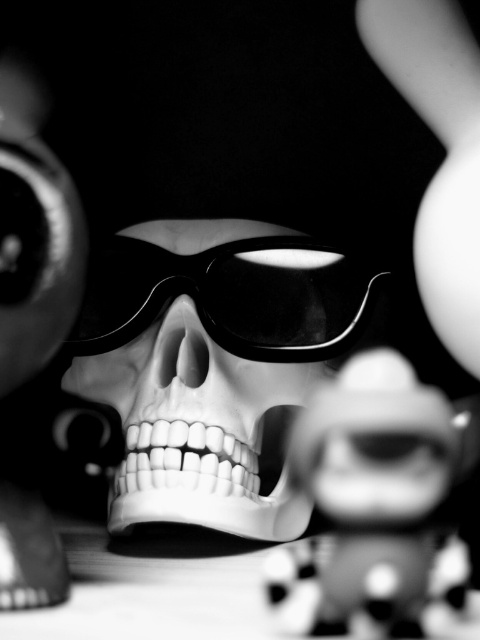
In the scene shown: You are an observer looking at the image. There are two points marked in the scene. The first point is at coordinates point (310, 582) and the second is at point (134, 296). Which point is closer to you?

Point (310, 582) is in front of point (134, 296), so it is closer to you.

You are an artist trying to paint this scene. You need to know which object should be painted larger to maintain the correct proportions. Which one should you make bigger between the polka dot fabric skull at center and the black glossy goggles at center?

The polka dot fabric skull at center is bigger than the black glossy goggles at center, so you should paint the polka dot fabric skull at center larger to maintain the correct proportions.

You are an artist analyzing this black and white image of a skull with sunglasses. You notice two points marked in the scene. From your perspective, which point is closer to you, point (289, 608) or point (243, 364)?

Point (289, 608) is in front of point (243, 364), so it is closer to you.